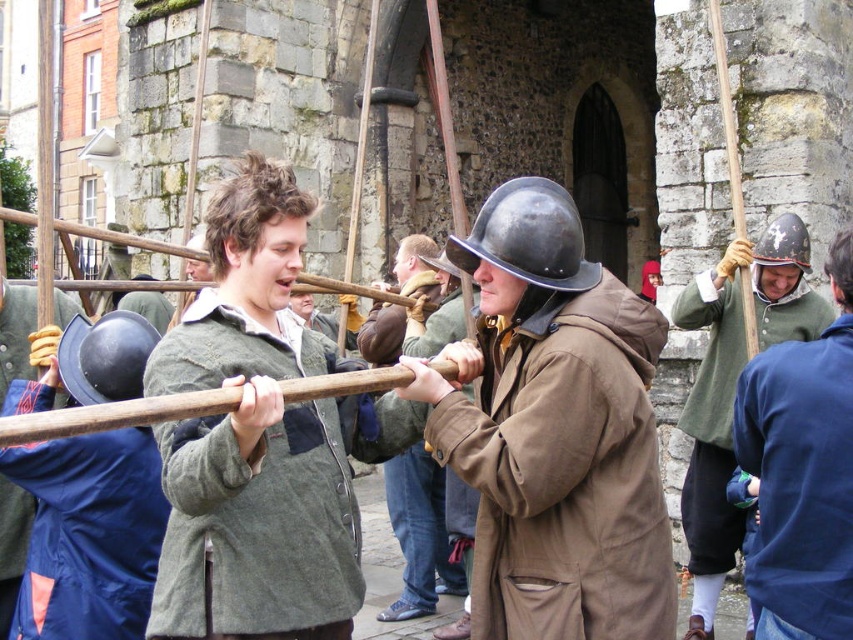
Question: Which object is the closest to the brown matte coat at center?

Choices:
 (A) shiny silver helmet at center
 (B) shiny black helmet at center
 (C) brown leather coat at center
 (D) matte black helmet at left

Answer: (C)

Question: Which point is closer to the camera?

Choices:
 (A) (68, 353)
 (B) (521, 262)

Answer: (B)

Question: Which object is farther from the camera taking this photo?

Choices:
 (A) green woolen sweater at center
 (B) brown matte coat at center
 (C) shiny silver helmet at center

Answer: (B)

Question: Can you confirm if matte black helmet at left is thinner than brown matte coat at center?

Choices:
 (A) no
 (B) yes

Answer: (A)

Question: Where is shiny metallic helmet at center located in relation to shiny silver helmet at center in the image?

Choices:
 (A) right
 (B) left

Answer: (B)

Question: Is matte black helmet at left above shiny silver helmet at center?

Choices:
 (A) no
 (B) yes

Answer: (A)